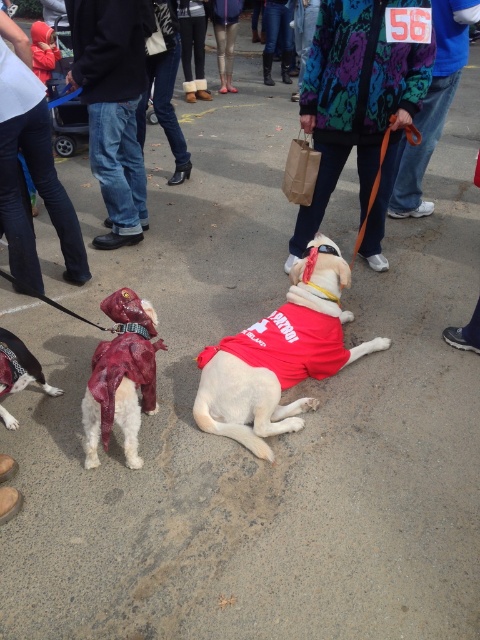
Can you confirm if jeans at left is positioned to the right of shiny red coat at lower left?

Correct, you'll find jeans at left to the right of shiny red coat at lower left.

This screenshot has height=640, width=480. What do you see at coordinates (112, 106) in the screenshot?
I see `jeans at left` at bounding box center [112, 106].

This screenshot has width=480, height=640. What are the coordinates of `jeans at left` in the screenshot? It's located at (112, 106).

I want to click on matte red shirt at center, so click(x=279, y=355).

Can you confirm if matte red shirt at center is positioned to the right of multicolored floral jacket at center?

No, matte red shirt at center is not to the right of multicolored floral jacket at center.

At what (x,y) coordinates should I click in order to perform the action: click on matte red shirt at center. Please return your answer as a coordinate pair (x, y). Looking at the image, I should click on (279, 355).

Can you confirm if jeans at left is smaller than denim pants at lower left?

Actually, jeans at left might be larger than denim pants at lower left.

Who is shorter, jeans at left or denim pants at lower left?

denim pants at lower left

This screenshot has width=480, height=640. What are the coordinates of `jeans at left` in the screenshot? It's located at (112, 106).

Locate an element on the screen. jeans at left is located at coordinates (112, 106).